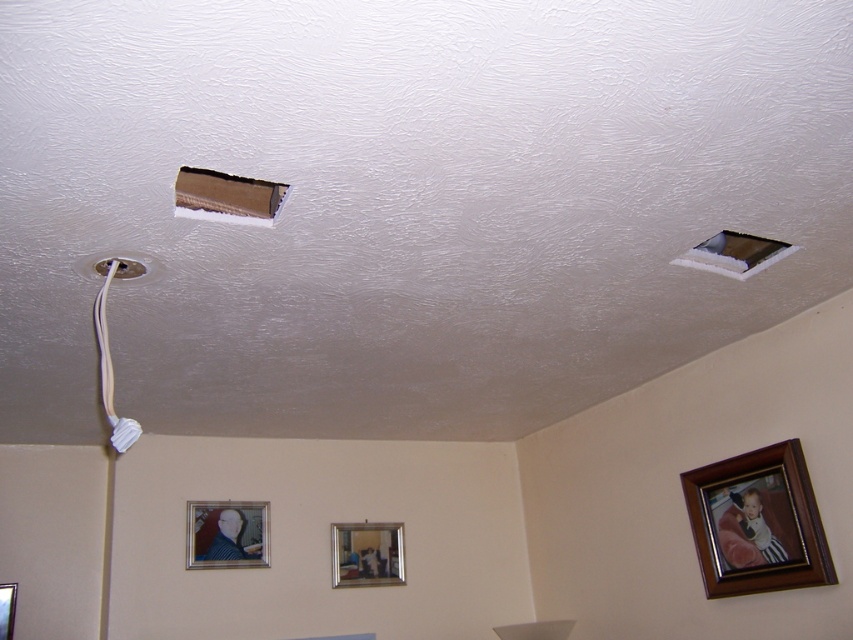
You are hanging a new picture frame on the wall. The wooden picture frame at center and the metallic silver picture frame at lower left are already there. Which existing frame should you avoid placing a larger frame next to if you want to maintain visual balance?

You should avoid placing a larger frame next to the wooden picture frame at center because it is already bigger than the metallic silver picture frame at lower left, so adding another large frame nearby could disrupt the balance.

You are an interior designer assessing the room. You need to hang a new picture that is the same size as the matte silver picture frame at lower left. Can the smooth white ceiling hole at upper right accommodate it without needing to enlarge the hole?

The matte silver picture frame at lower left is larger in width than the smooth white ceiling hole at upper right, so the hole cannot accommodate the new picture without being enlarged.

You are hanging a new matte silver picture frame at lower left and a white plastic hole at upper left on a wall. Which object has a greater width?

The matte silver picture frame at lower left has a greater width than the white plastic hole at upper left.